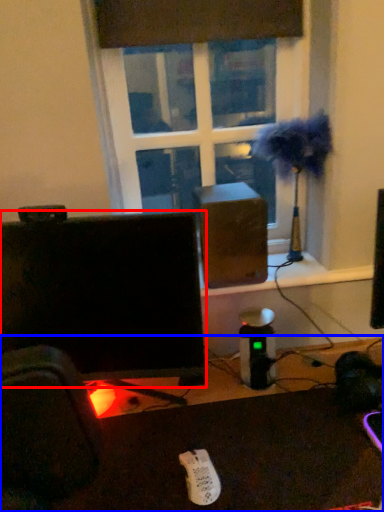
Question: Which object appears closest to the camera in this image, computer monitor (highlighted by a red box) or desk (highlighted by a blue box)?

Choices:
 (A) computer monitor
 (B) desk

Answer: (B)